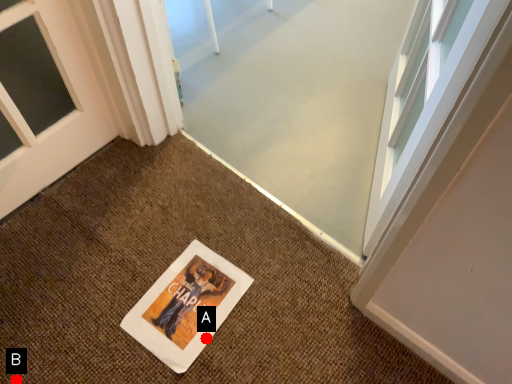
Question: Two points are circled on the image, labeled by A and B beside each circle. Which point appears closest to the camera in this image?

Choices:
 (A) A is closer
 (B) B is closer

Answer: (B)